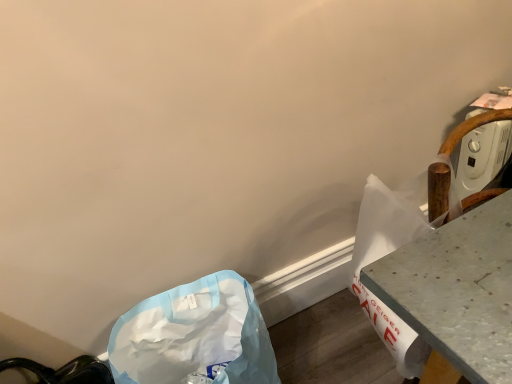
The height and width of the screenshot is (384, 512). Identify the location of blue plastic bag at lower left. (194, 335).

What is the approximate width of blue plastic bag at lower left?

The width of blue plastic bag at lower left is 14.95 inches.

Describe the element at coordinates (194, 335) in the screenshot. The height and width of the screenshot is (384, 512). I see `blue plastic bag at lower left` at that location.

The height and width of the screenshot is (384, 512). Describe the element at coordinates (457, 290) in the screenshot. I see `metallic gray table at right` at that location.

Measure the distance between point (452,362) and camera.

They are 22.32 inches apart.

This screenshot has width=512, height=384. What are the coordinates of `metallic gray table at right` in the screenshot? It's located at (457, 290).

The width and height of the screenshot is (512, 384). I want to click on blue plastic bag at lower left, so click(x=194, y=335).

Is metallic gray table at right to the left of blue plastic bag at lower left from the viewer's perspective?

No, metallic gray table at right is not to the left of blue plastic bag at lower left.

Is metallic gray table at right in front of blue plastic bag at lower left?

Yes.

Which is behind, point (415, 284) or point (139, 303)?

Point (139, 303)

From the image's perspective, which is above, metallic gray table at right or blue plastic bag at lower left?

From the image's view, metallic gray table at right is above.

From a real-world perspective, which object rests below the other?

blue plastic bag at lower left, from a real-world perspective.

In the scene shown: Can you confirm if metallic gray table at right is thinner than blue plastic bag at lower left?

Yes.

Does metallic gray table at right have a lesser height compared to blue plastic bag at lower left?

In fact, metallic gray table at right may be taller than blue plastic bag at lower left.

Considering the sizes of objects metallic gray table at right and blue plastic bag at lower left in the image provided, who is bigger, metallic gray table at right or blue plastic bag at lower left?

With larger size is metallic gray table at right.

Is metallic gray table at right outside of blue plastic bag at lower left?

Absolutely, metallic gray table at right is external to blue plastic bag at lower left.

Is metallic gray table at right in contact with blue plastic bag at lower left?

No, metallic gray table at right is not in contact with blue plastic bag at lower left.

In the scene shown: Could you tell me if metallic gray table at right is turned towards blue plastic bag at lower left?

No, metallic gray table at right is not aimed at blue plastic bag at lower left.

Based on the photo, can you tell me how much metallic gray table at right and blue plastic bag at lower left differ in facing direction?

0.0465 degrees separate the facing orientations of metallic gray table at right and blue plastic bag at lower left.

This screenshot has width=512, height=384. What are the coordinates of `table above the blue plastic bag at lower left (from a real-world perspective)` in the screenshot? It's located at (457, 290).

Which is more to the left, blue plastic bag at lower left or metallic gray table at right?

Positioned to the left is blue plastic bag at lower left.

Which is behind, blue plastic bag at lower left or metallic gray table at right?

blue plastic bag at lower left is further away from the camera.

Does point (112, 335) come behind point (455, 307)?

Yes, point (112, 335) is behind point (455, 307).

From the image's perspective, which object appears higher, blue plastic bag at lower left or metallic gray table at right?

From the image's view, metallic gray table at right is above.

Based on the photo, from a real-world perspective, is blue plastic bag at lower left positioned over metallic gray table at right based on gravity?

No, from a real-world perspective, blue plastic bag at lower left is not over metallic gray table at right

Which of these two, blue plastic bag at lower left or metallic gray table at right, is wider?

blue plastic bag at lower left.

Who is shorter, blue plastic bag at lower left or metallic gray table at right?

With less height is blue plastic bag at lower left.

Considering the sizes of objects blue plastic bag at lower left and metallic gray table at right in the image provided, who is bigger, blue plastic bag at lower left or metallic gray table at right?

metallic gray table at right.

Is blue plastic bag at lower left not inside metallic gray table at right?

Yes.

Is blue plastic bag at lower left next to metallic gray table at right?

No, blue plastic bag at lower left is not making contact with metallic gray table at right.

Is blue plastic bag at lower left looking in the opposite direction of metallic gray table at right?

blue plastic bag at lower left does not have its back to metallic gray table at right.

At what (x,y) coordinates should I click in order to perform the action: click on table above the blue plastic bag at lower left (from a real-world perspective). Please return your answer as a coordinate pair (x, y). Looking at the image, I should click on (457, 290).

The image size is (512, 384). I want to click on table above the blue plastic bag at lower left (from the image's perspective), so click(457, 290).

The height and width of the screenshot is (384, 512). I want to click on plastic bag below the metallic gray table at right (from the image's perspective), so click(x=194, y=335).